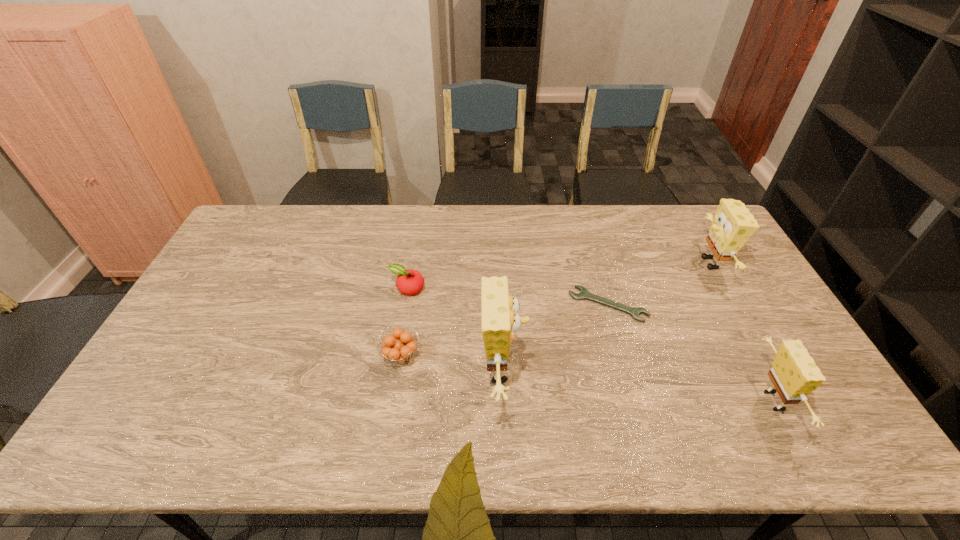
Find the location of `the tallest object`. the tallest object is located at coordinates (499, 320).

Where is `the fourth object from right to left`? This screenshot has height=540, width=960. the fourth object from right to left is located at coordinates (499, 320).

Find the location of a particular element. The image size is (960, 540). the third tallest object is located at coordinates (794, 374).

I want to click on the fifth shortest object, so [733, 224].

Locate an element on the screen. This screenshot has width=960, height=540. the farthest sponge is located at coordinates (733, 224).

Image resolution: width=960 pixels, height=540 pixels. In order to click on apple in this screenshot , I will do `click(409, 282)`.

The image size is (960, 540). I want to click on the third object from right to left, so click(584, 294).

Identify the location of wrench. The image size is (960, 540). (584, 294).

The width and height of the screenshot is (960, 540). I want to click on orange fruit, so [399, 353].

You are a GUI agent. You are given a task and a screenshot of the screen. Output one action in this format:
    pyautogui.click(x=<x>, y=<y>)
    Task: Click on the free space located 0.230m on the face of the tallest sponge
    This screenshot has width=960, height=540.
    Given the screenshot: What is the action you would take?
    pyautogui.click(x=611, y=369)